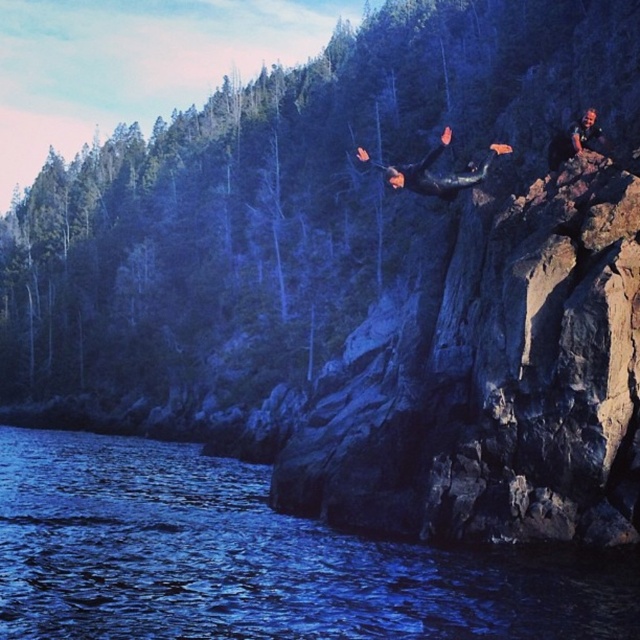
You are a safety officer assessing the diving area. You need to ensure that the blue liquid water at lower left has enough width to safely accommodate the black matte wetsuit at center when it enters the water. Based on the scene, can you confirm if the water is wide enough?

The blue liquid water at lower left might be wider than black matte wetsuit at center, so it is possible that the water is wide enough for safe entry.

Consider the image. You are a drone operator tasked with capturing aerial footage of the cliff diving scene. You need to ensure the blue liquid water at lower left is visible in the shot. Based on its coordinates, can you confirm if the water is positioned within the lower half of the image?

The blue liquid water at lower left is located at point (253, 560), which falls within the lower half of the image since the y coordinate is less than 0.5. Therefore, the water is positioned in the lower half and will be visible in the shot.

You are a photographer positioned at the camera location capturing this cliff diving scene. You want to ensure that the point at coordinates point (340, 556) is in focus. If your camera has a depth of field that can sharply capture objects between 140 feet and 150 feet away, will the point be in focus?

The distance of point (340, 556) from the camera is 148.14 feet, which falls within the depth of field range of 140 feet to 150 feet. Therefore, the point will be in focus.